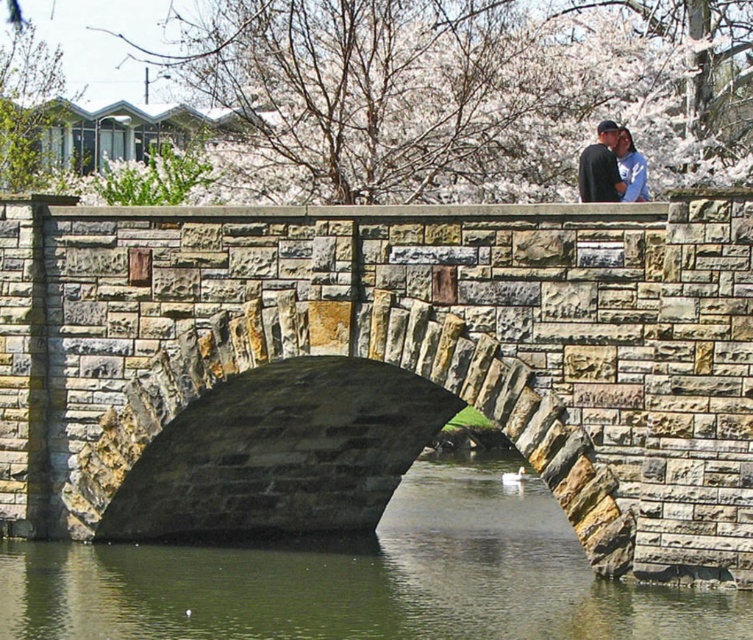
You are a photographer standing on the stone bridge. You see the green stone river at center and the blue denim jacket at upper center in your viewfinder. Which object appears taller in the photo?

The blue denim jacket at upper center appears taller than the green stone river at center in the photo because the green stone river at center has a lesser height compared to the blue denim jacket at upper center.